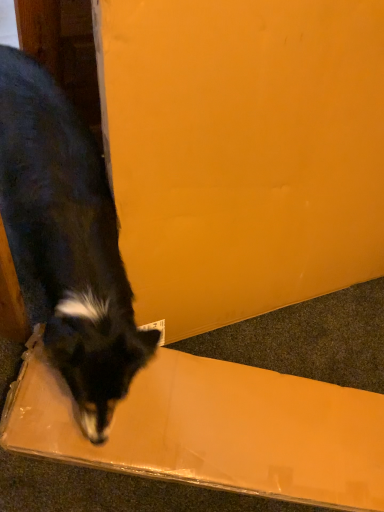
Image resolution: width=384 pixels, height=512 pixels. What do you see at coordinates (214, 429) in the screenshot?
I see `matte cardboard box at lower center` at bounding box center [214, 429].

What is the approximate height of matte cardboard box at lower center?

5.98 inches.

Image resolution: width=384 pixels, height=512 pixels. Identify the location of matte cardboard box at lower center. (214, 429).

This screenshot has height=512, width=384. What are the coordinates of `matte cardboard box at lower center` in the screenshot? It's located at (214, 429).